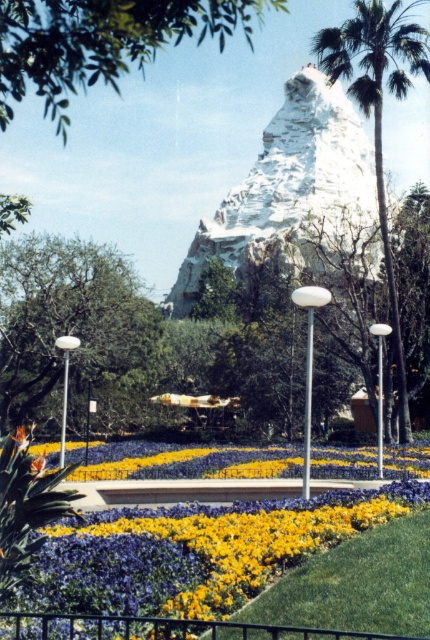
Question: Can you confirm if green leafy tree at upper center is wider than green leafy palm tree at upper right?

Choices:
 (A) no
 (B) yes

Answer: (B)

Question: Considering the relative positions of green leafy tree at upper center and green leafy palm tree at upper right in the image provided, where is green leafy tree at upper center located with respect to green leafy palm tree at upper right?

Choices:
 (A) above
 (B) below

Answer: (A)

Question: Which point is farther from the camera taking this photo?

Choices:
 (A) (254, 180)
 (B) (131, 64)
 (C) (375, 160)
 (D) (42, 240)

Answer: (B)

Question: Which is farther from the green leafy tree at lower left?

Choices:
 (A) yellow matte flower bed at center
 (B) white rocky mountain at center

Answer: (A)

Question: Which point is closer to the camera?

Choices:
 (A) white rocky mountain at center
 (B) green leafy tree at lower left
 (C) yellow matte flower bed at center

Answer: (C)

Question: Does yellow matte flower bed at center have a smaller size compared to green leafy palm tree at upper right?

Choices:
 (A) yes
 (B) no

Answer: (A)